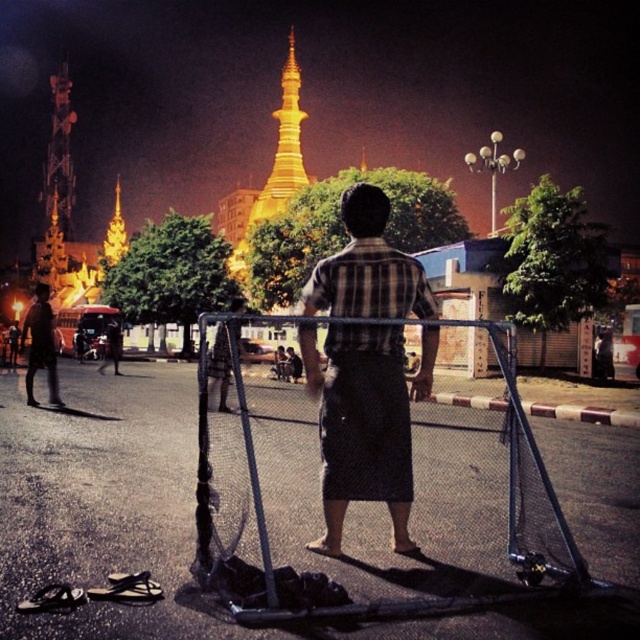
Question: Considering the real-world distances, which object is closest to the metallic wire fence at center?

Choices:
 (A) dark gray pants at lower left
 (B) plaid fabric shirt at center

Answer: (B)

Question: Is metallic wire fence at center to the left of plaid fabric shirt at center from the viewer's perspective?

Choices:
 (A) yes
 (B) no

Answer: (B)

Question: Observing the image, what is the correct spatial positioning of plaid fabric shirt at center in reference to dark gray pants at lower left?

Choices:
 (A) above
 (B) below

Answer: (B)

Question: Which of the following is the farthest from the observer?

Choices:
 (A) dark gray pants at lower left
 (B) metallic wire fence at center
 (C) plaid fabric shirt at center

Answer: (A)

Question: Which of the following is the farthest from the observer?

Choices:
 (A) dark gray pants at lower left
 (B) plaid fabric shirt at center
 (C) metallic wire fence at center

Answer: (A)

Question: Can you confirm if metallic wire fence at center is positioned to the right of dark gray pants at lower left?

Choices:
 (A) yes
 (B) no

Answer: (A)